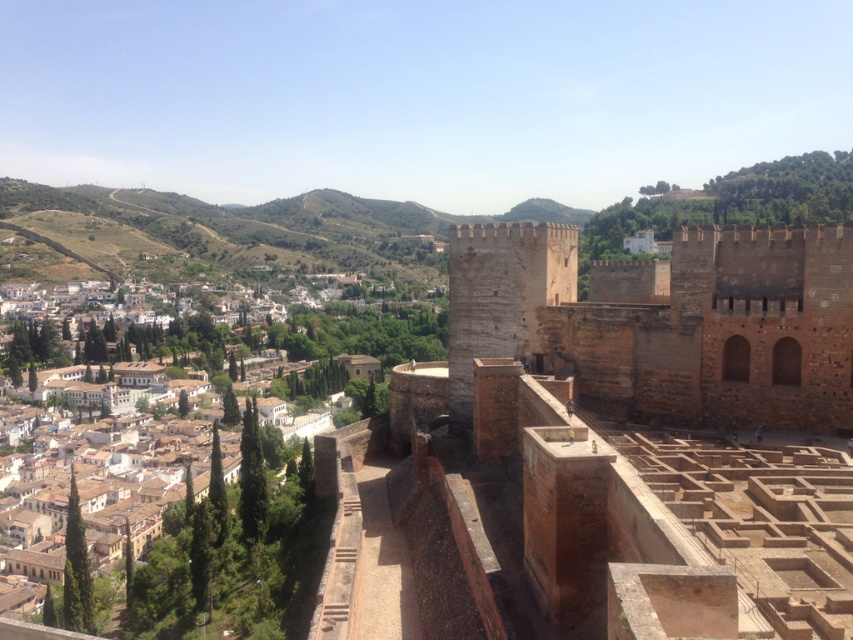
Question: Can you confirm if brown stone fort at center is bigger than brown stone town at center?

Choices:
 (A) yes
 (B) no

Answer: (B)

Question: Which of the following is the closest to the observer?

Choices:
 (A) (612, 564)
 (B) (172, 605)

Answer: (A)

Question: From the image, what is the correct spatial relationship of brown stone fort at center in relation to brown stone town at center?

Choices:
 (A) below
 (B) above

Answer: (B)

Question: Which point appears farthest from the camera in this image?

Choices:
 (A) (543, 412)
 (B) (167, 556)

Answer: (B)

Question: Is brown stone fort at center positioned in front of brown stone town at center?

Choices:
 (A) no
 (B) yes

Answer: (B)